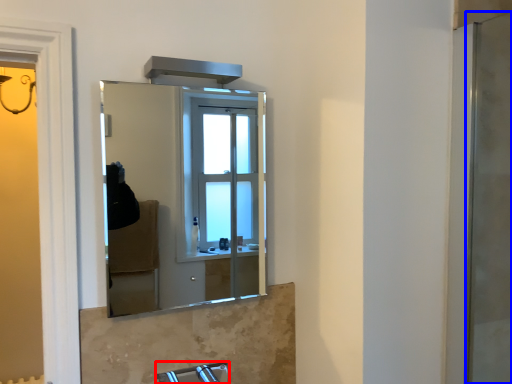
Question: Among these objects, which one is nearest to the camera, faucet (highlighted by a red box) or screen door (highlighted by a blue box)?

Choices:
 (A) faucet
 (B) screen door

Answer: (A)